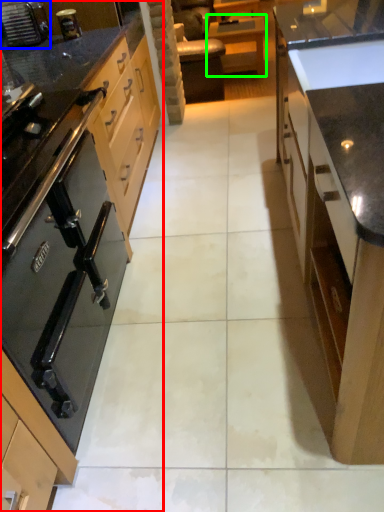
Question: Based on their relative distances, which object is nearer to cabinetry (highlighted by a red box)? Choose from home appliance (highlighted by a blue box) and table (highlighted by a green box).

Choices:
 (A) home appliance
 (B) table

Answer: (A)